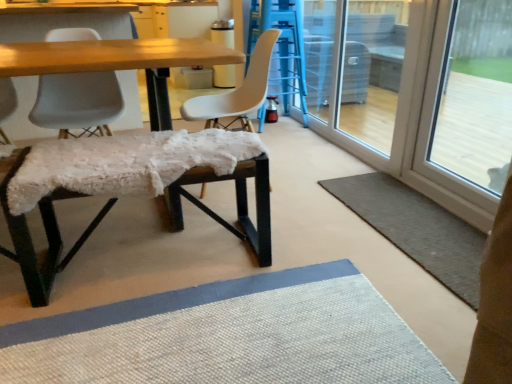
Question: Which direction should I rotate to look at matte blue bar stool at center, which is the 1th bar stool from top to bottom?

Choices:
 (A) left
 (B) right

Answer: (B)

Question: Is wooden table at center located outside transparent glass door at right?

Choices:
 (A) no
 (B) yes

Answer: (B)

Question: From a real-world perspective, is wooden table at center under transparent glass door at right?

Choices:
 (A) no
 (B) yes

Answer: (B)

Question: From a real-world perspective, is wooden table at center on top of transparent glass door at right?

Choices:
 (A) yes
 (B) no

Answer: (B)

Question: Does wooden table at center lie behind transparent glass door at right?

Choices:
 (A) no
 (B) yes

Answer: (B)

Question: From the image's perspective, is wooden table at center beneath transparent glass door at right?

Choices:
 (A) no
 (B) yes

Answer: (A)

Question: Can you confirm if wooden table at center is taller than transparent glass door at right?

Choices:
 (A) no
 (B) yes

Answer: (B)

Question: Is transparent glass door at right to the left of gray textured rug at lower right from the viewer's perspective?

Choices:
 (A) yes
 (B) no

Answer: (B)

Question: From the image's perspective, is transparent glass door at right below gray textured rug at lower right?

Choices:
 (A) no
 (B) yes

Answer: (A)

Question: From the image's perspective, is transparent glass door at right on gray textured rug at lower right?

Choices:
 (A) no
 (B) yes

Answer: (B)

Question: Is gray textured rug at lower right completely or partially inside transparent glass door at right?

Choices:
 (A) no
 (B) yes

Answer: (A)

Question: Considering the relative sizes of transparent glass door at right and gray textured rug at lower right in the image provided, is transparent glass door at right thinner than gray textured rug at lower right?

Choices:
 (A) no
 (B) yes

Answer: (B)

Question: Would you consider transparent glass door at right to be distant from gray textured rug at lower right?

Choices:
 (A) no
 (B) yes

Answer: (B)

Question: Is wooden table at center positioned beyond the bounds of transparent glass screen door at right?

Choices:
 (A) yes
 (B) no

Answer: (A)